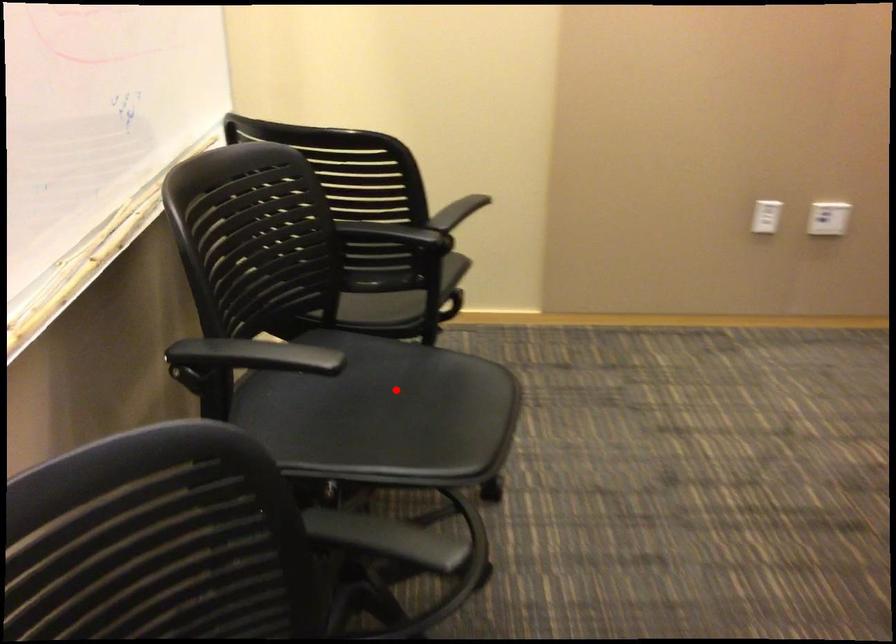
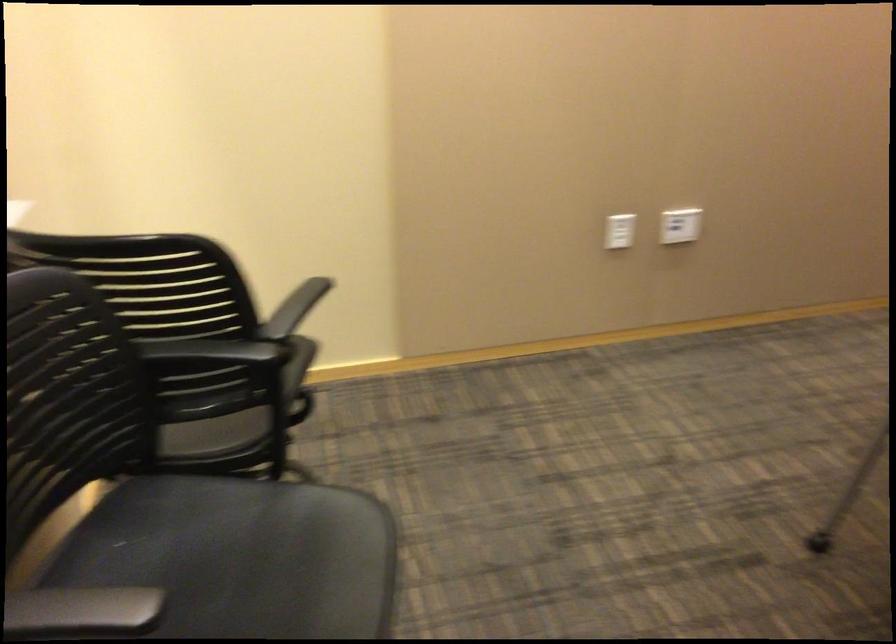
Where in the second image is the point corresponding to the highlighted location from the first image?

(239, 556)